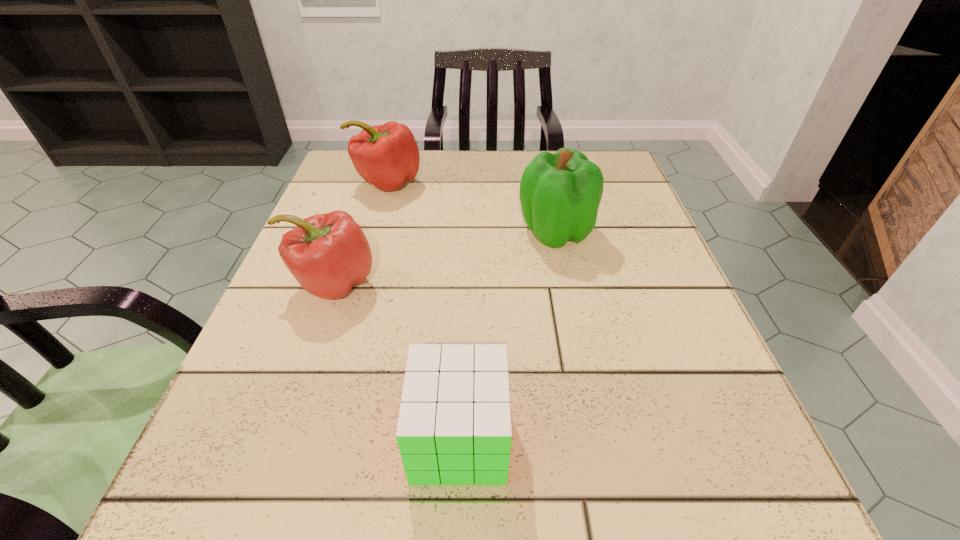
Identify the location of object that is positioned at the far edge. (386, 156).

This screenshot has height=540, width=960. Identify the location of object that is at the near edge. (454, 427).

You are a GUI agent. You are given a task and a screenshot of the screen. Output one action in this format:
    pyautogui.click(x=<x>, y=<y>)
    Task: Click on the object at the right edge
    The image size is (960, 540).
    Given the screenshot: What is the action you would take?
    pyautogui.click(x=560, y=194)

Identify the location of object that is positioned at the far left corner. (386, 156).

In the image, there is a desktop. At what (x,y) coordinates should I click in order to perform the action: click on free space at the far edge. Please return your answer as a coordinate pair (x, y). The image size is (960, 540). Looking at the image, I should click on coord(488,186).

In order to click on free space at the near edge of the desktop in this screenshot , I will do `click(508, 483)`.

In the image, there is a desktop. Where is `vacant region at the left edge`? This screenshot has width=960, height=540. vacant region at the left edge is located at coordinates (370, 217).

The image size is (960, 540). In the image, there is a desktop. In order to click on free space at the right edge in this screenshot , I will do `click(597, 328)`.

The image size is (960, 540). I want to click on blank space at the far left corner of the desktop, so click(x=349, y=184).

This screenshot has height=540, width=960. What are the coordinates of `vacant space at the near left corner` in the screenshot? It's located at (203, 475).